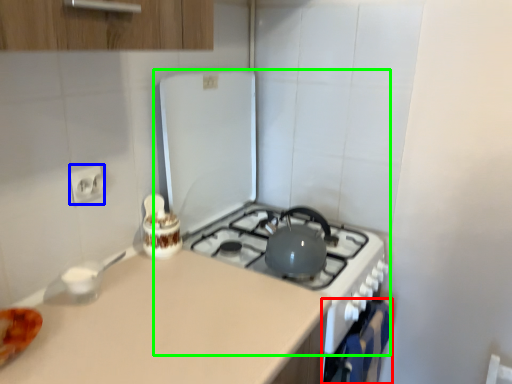
Question: Considering the real-world distances, which object is farthest from oven (highlighted by a red box)? electric outlet (highlighted by a blue box) or appliance (highlighted by a green box)?

Choices:
 (A) electric outlet
 (B) appliance

Answer: (A)